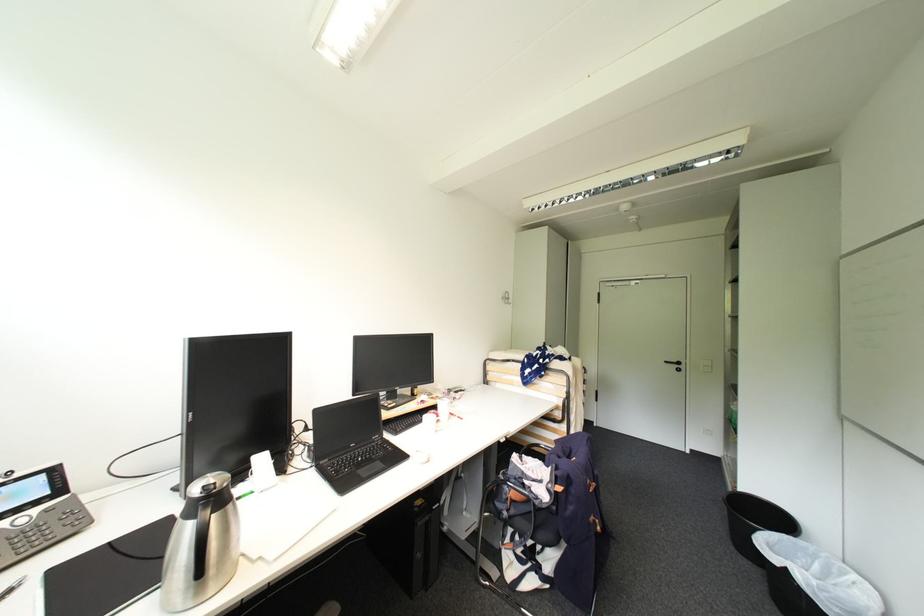
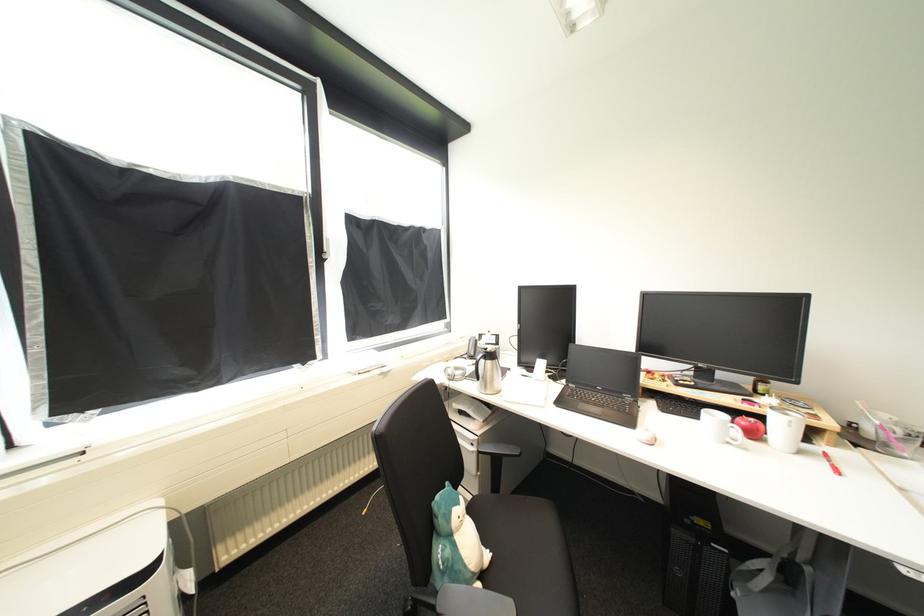
Question: The camera is either moving clockwise (left) or counter-clockwise (right) around the object. The first image is from the beginning of the video and the second image is from the end. Is the camera moving left or right when shooting the video?

Choices:
 (A) Left
 (B) Right

Answer: (B)